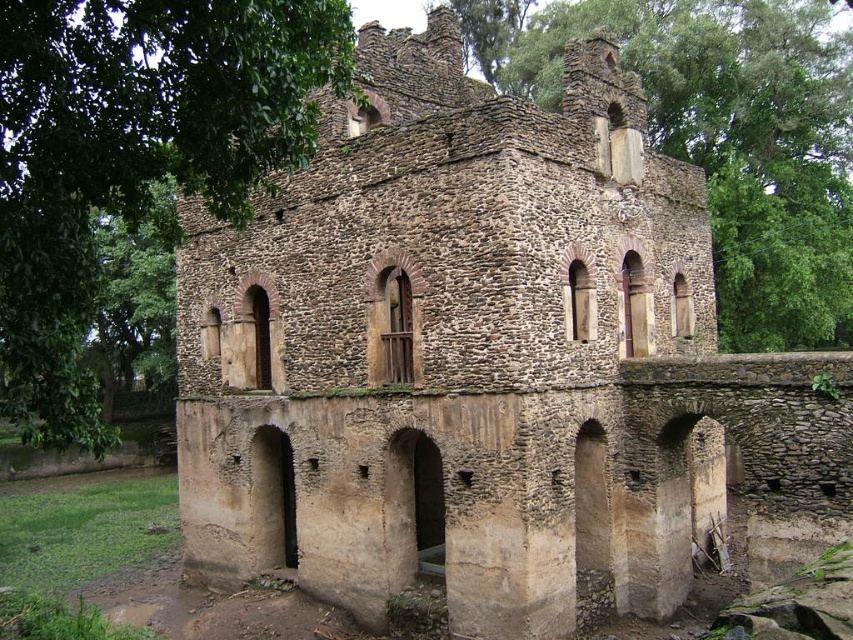
You are standing at the camera position and want to take a photo of the green leafy tree at left. If your camera has a maximum focus range of 25 meters, will you be able to capture the tree clearly?

The green leafy tree at left and camera are 23.86 meters apart from each other, so yes, the camera can focus on the tree clearly since the distance is within the 25 meters range.

You are standing in front of the ancient stone structure and notice two green leafy trees. Which tree, the green leafy tree at left or the green leafy tree at upper center, is taller?

The green leafy tree at upper center is taller than the green leafy tree at left.

You are an architect visiting this historical site. You notice two green leafy trees in the image. Which tree, the green leafy tree at left or the green leafy tree at upper center, would cast a larger shadow given their sizes?

The green leafy tree at left is bigger than the green leafy tree at upper center, so it would cast a larger shadow.